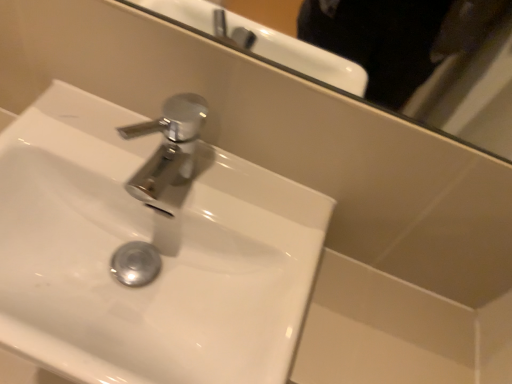
This screenshot has height=384, width=512. What do you see at coordinates (148, 245) in the screenshot?
I see `white glossy sink at center` at bounding box center [148, 245].

Identify the location of white glossy sink at center. (148, 245).

This screenshot has height=384, width=512. In order to click on white glossy sink at center in this screenshot , I will do `click(148, 245)`.